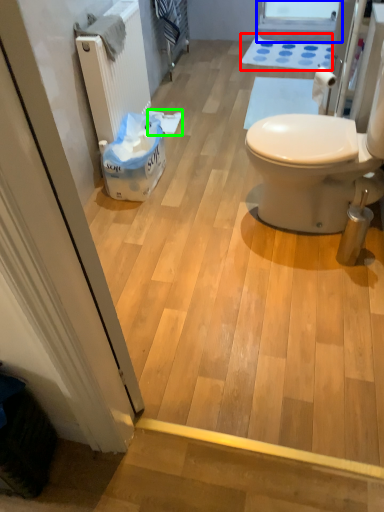
Question: Which is farther away from bath mat (highlighted by a red box)? window screen (highlighted by a blue box) or toilet paper (highlighted by a green box)?

Choices:
 (A) window screen
 (B) toilet paper

Answer: (B)